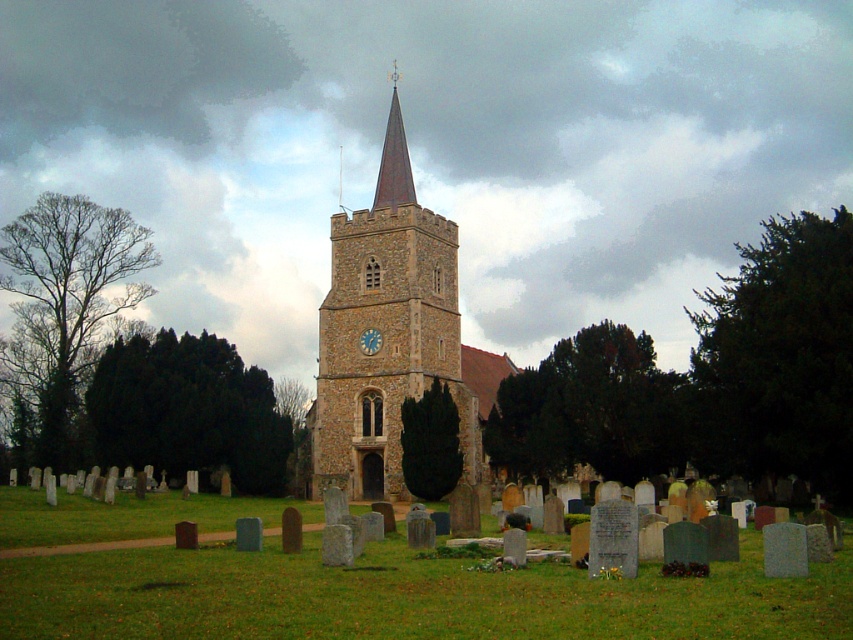
Question: Which point is closer to the camera?

Choices:
 (A) green grassy at lower center
 (B) brown stone clock tower at center
 (C) smooth red steeple at center
 (D) blue painted clock face at center

Answer: (A)

Question: Among these points, which one is farthest from the camera?

Choices:
 (A) (724, 579)
 (B) (387, 189)

Answer: (B)

Question: Is brown stone clock tower at center bigger than smooth red steeple at center?

Choices:
 (A) yes
 (B) no

Answer: (A)

Question: Which object appears closest to the camera in this image?

Choices:
 (A) brown stone clock tower at center
 (B) smooth red steeple at center
 (C) blue painted clock face at center

Answer: (A)

Question: Is green grassy at lower center thinner than blue painted clock face at center?

Choices:
 (A) yes
 (B) no

Answer: (B)

Question: Does green grassy at lower center come in front of brown stone clock tower at center?

Choices:
 (A) yes
 (B) no

Answer: (A)